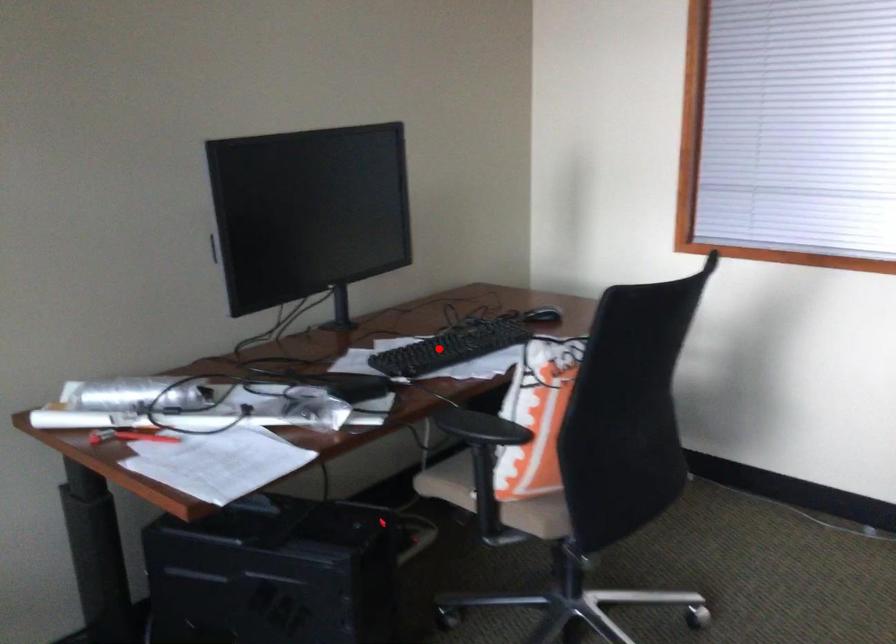
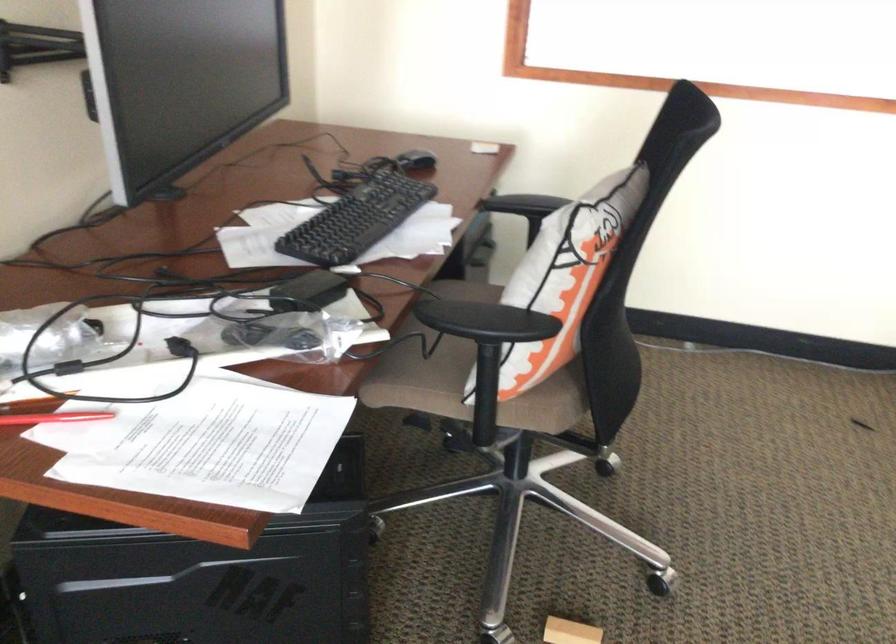
Question: I am providing you with two images of the same scene from different viewpoints. A red point is shown in image1. For the corresponding object point in image2, is it positioned nearer or farther from the camera?

Choices:
 (A) Nearer
 (B) Farther

Answer: (A)